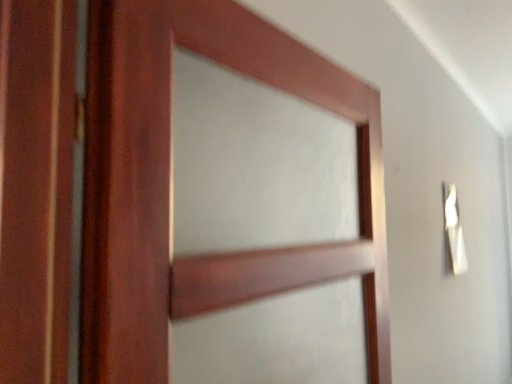
The image size is (512, 384). What do you see at coordinates (169, 186) in the screenshot? I see `mahogany wood door at center` at bounding box center [169, 186].

Where is `mahogany wood door at center`? The height and width of the screenshot is (384, 512). mahogany wood door at center is located at coordinates (169, 186).

At what (x,y) coordinates should I click in order to perform the action: click on mahogany wood door at center. Please return your answer as a coordinate pair (x, y). Looking at the image, I should click on (169, 186).